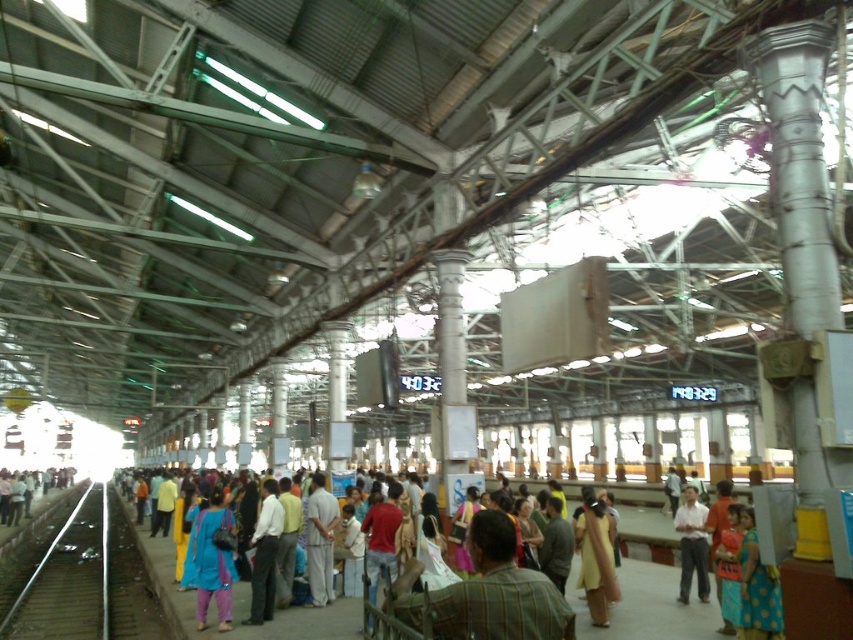
Does light blue fabric dress at center appear on the right side of yellow cotton dress at center?

In fact, light blue fabric dress at center is to the left of yellow cotton dress at center.

Does light blue fabric dress at center appear on the left side of yellow cotton dress at center?

Yes, light blue fabric dress at center is to the left of yellow cotton dress at center.

Describe the element at coordinates (646, 593) in the screenshot. I see `light blue fabric dress at center` at that location.

Find the location of a particular element. Image resolution: width=853 pixels, height=640 pixels. light blue fabric dress at center is located at coordinates (646, 593).

Between matte blue dress at center and yellow cotton dress at center, which one appears on the right side from the viewer's perspective?

Positioned to the right is yellow cotton dress at center.

Describe the element at coordinates (213, 561) in the screenshot. I see `matte blue dress at center` at that location.

At what (x,y) coordinates should I click in order to perform the action: click on matte blue dress at center. Please return your answer as a coordinate pair (x, y). Image resolution: width=853 pixels, height=640 pixels. Looking at the image, I should click on (213, 561).

Which of these two, matte blue dress at center or light brown fabric shirt at center, stands shorter?

matte blue dress at center is shorter.

Between point (218, 493) and point (694, 513), which one is positioned in front?

Point (694, 513) is in front.

Is point (225, 556) positioned behind point (686, 593)?

No, it is in front of (686, 593).

Find the location of `matte blue dress at center`. matte blue dress at center is located at coordinates (213, 561).